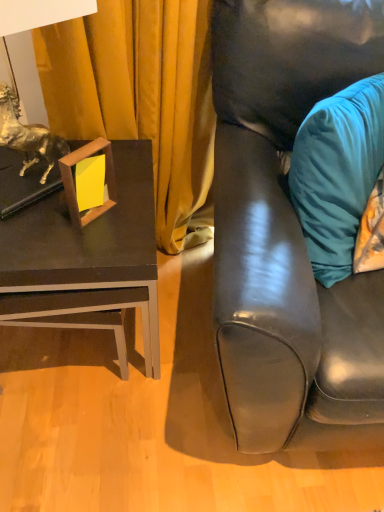
The width and height of the screenshot is (384, 512). Find the location of `vacant space to the right of woodenobject at left`. vacant space to the right of woodenobject at left is located at coordinates (135, 218).